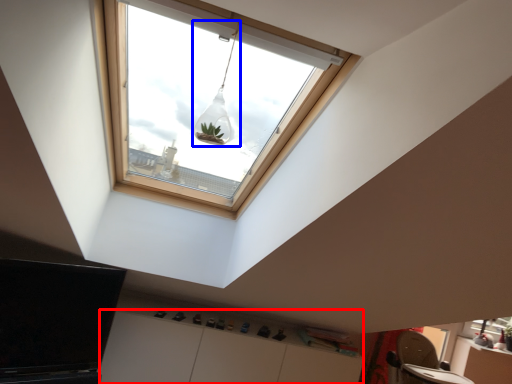
Question: Which of the following is the closest to the observer, cabinetry (highlighted by a red box) or light fixture (highlighted by a blue box)?

Choices:
 (A) cabinetry
 (B) light fixture

Answer: (B)